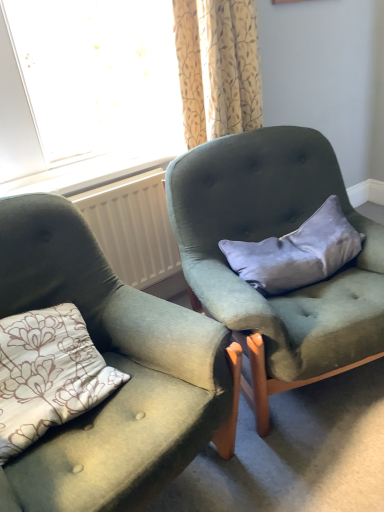
The image size is (384, 512). In order to click on velvet green armchair at center, which is the 2th chair in right-to-left order in this screenshot , I will do `click(110, 365)`.

The height and width of the screenshot is (512, 384). What do you see at coordinates (297, 252) in the screenshot?
I see `velvet gray pillow at center` at bounding box center [297, 252].

Where is `velvet green armchair at center, acting as the 1th chair starting from the left`? The width and height of the screenshot is (384, 512). velvet green armchair at center, acting as the 1th chair starting from the left is located at coordinates (x=110, y=365).

Is velvet green armchair at center, which is the first chair in right-to-left order, positioned with its back to velvet green armchair at center, which is the 2th chair in right-to-left order?

velvet green armchair at center, which is the first chair in right-to-left order, does not have its back to velvet green armchair at center, which is the 2th chair in right-to-left order.

Is velvet green armchair at center, which is the first chair in right-to-left order, not within velvet green armchair at center, acting as the 1th chair starting from the left?

→ Yes, velvet green armchair at center, which is the first chair in right-to-left order, is outside of velvet green armchair at center, acting as the 1th chair starting from the left.

From a real-world perspective, is velvet green armchair at center, which is the first chair in right-to-left order, below velvet green armchair at center, which is the 2th chair in right-to-left order?

Yes, from a real-world perspective, velvet green armchair at center, which is the first chair in right-to-left order, is beneath velvet green armchair at center, which is the 2th chair in right-to-left order.

Considering the positions of points (290, 319) and (223, 399), is point (290, 319) farther from camera compared to point (223, 399)?

Yes, point (290, 319) is behind point (223, 399).

Between white plastic radiator at center and floral fabric curtain at upper center, which one has more height?

floral fabric curtain at upper center is taller.

Considering the points (166, 274) and (212, 42), which point is behind, point (166, 274) or point (212, 42)?

Point (166, 274)

Is white plastic radiator at center placed right next to floral fabric curtain at upper center?

No, white plastic radiator at center is not in contact with floral fabric curtain at upper center.

Would you say floral fabric curtain at upper center is part of white plastic radiator at center's contents?

No.

Is velvet gray pillow at center not near velvet green armchair at center, which is the first chair in right-to-left order?

No, there isn't a large distance between velvet gray pillow at center and velvet green armchair at center, which is the first chair in right-to-left order.

Considering the relative sizes of velvet gray pillow at center and velvet green armchair at center, which is the first chair in right-to-left order, in the image provided, is velvet gray pillow at center thinner than velvet green armchair at center, which is the first chair in right-to-left order,?

Correct, the width of velvet gray pillow at center is less than that of velvet green armchair at center, which is the first chair in right-to-left order.

From the image's perspective, does velvet gray pillow at center appear lower than velvet green armchair at center, which is counted as the second chair, starting from the left?

No, from the image's perspective, velvet gray pillow at center is not below velvet green armchair at center, which is counted as the second chair, starting from the left.

From a real-world perspective, which is physically below, white plastic radiator at center or velvet gray pillow at center?

white plastic radiator at center is physically lower.

From the image's perspective, is white plastic radiator at center below velvet gray pillow at center?

Actually, white plastic radiator at center appears above velvet gray pillow at center in the image.

Is point (151, 174) positioned in front of point (336, 216)?

That is False.

The height and width of the screenshot is (512, 384). Identify the location of the 1st chair in front of the floral fabric curtain at upper center, counting from the anchor's position. (276, 236).

From the picture: Does velvet green armchair at center, which is counted as the second chair, starting from the left, have a greater height compared to floral fabric curtain at upper center?

Yes.

Between point (299, 352) and point (227, 86), which one is positioned behind?

The point (227, 86) is farther from the camera.

Is velvet green armchair at center, which is counted as the second chair, starting from the left, next to floral fabric curtain at upper center and touching it?

No, velvet green armchair at center, which is counted as the second chair, starting from the left, is not with floral fabric curtain at upper center.

Is velvet gray pillow at center facing towards velvet green armchair at center, acting as the 1th chair starting from the left?

No, velvet gray pillow at center does not turn towards velvet green armchair at center, acting as the 1th chair starting from the left.

Considering the relative positions of velvet gray pillow at center and velvet green armchair at center, acting as the 1th chair starting from the left, in the image provided, is velvet gray pillow at center to the right of velvet green armchair at center, acting as the 1th chair starting from the left, from the viewer's perspective?

Yes.

In terms of width, does velvet gray pillow at center look wider or thinner when compared to velvet green armchair at center, acting as the 1th chair starting from the left?

Clearly, velvet gray pillow at center has less width compared to velvet green armchair at center, acting as the 1th chair starting from the left.

Between velvet gray pillow at center and velvet green armchair at center, acting as the 1th chair starting from the left, which one has smaller size?

velvet gray pillow at center.

What's the angular difference between velvet gray pillow at center and floral fabric curtain at upper center's facing directions?

16 degrees.

Is velvet gray pillow at center to the right of floral fabric curtain at upper center from the viewer's perspective?

Yes, velvet gray pillow at center is to the right of floral fabric curtain at upper center.

Can you confirm if velvet gray pillow at center is taller than floral fabric curtain at upper center?

Incorrect, the height of velvet gray pillow at center is not larger of that of floral fabric curtain at upper center.

Considering the sizes of objects velvet gray pillow at center and floral fabric curtain at upper center in the image provided, who is bigger, velvet gray pillow at center or floral fabric curtain at upper center?

With larger size is floral fabric curtain at upper center.

There is a velvet green armchair at center, which is counted as the second chair, starting from the left. At what (x,y) coordinates should I click in order to perform the action: click on chair above it (from a real-world perspective). Please return your answer as a coordinate pair (x, y). This screenshot has height=512, width=384. Looking at the image, I should click on (110, 365).

I want to click on radiator that appears behind the floral fabric curtain at upper center, so click(133, 227).

Based on the photo, from the image, which object appears to be farther from velvet gray pillow at center, white plastic radiator at center or floral fabric curtain at upper center?

Based on the image, floral fabric curtain at upper center appears to be further to velvet gray pillow at center.

When comparing their distances from white plastic radiator at center, does velvet green armchair at center, acting as the 1th chair starting from the left, or velvet gray pillow at center seem further?

The object further to white plastic radiator at center is velvet gray pillow at center.

Based on their spatial positions, is white plastic radiator at center or velvet gray pillow at center closer to velvet green armchair at center, which is the 2th chair in right-to-left order?

Among the two, velvet gray pillow at center is located nearer to velvet green armchair at center, which is the 2th chair in right-to-left order.

Looking at the image, which one is located further to velvet gray pillow at center, floral fabric curtain at upper center or white plastic radiator at center?

Among the two, floral fabric curtain at upper center is located further to velvet gray pillow at center.

Considering their positions, is velvet gray pillow at center positioned closer to velvet green armchair at center, which is counted as the second chair, starting from the left, than velvet green armchair at center, acting as the 1th chair starting from the left?

velvet gray pillow at center is closer to velvet green armchair at center, which is counted as the second chair, starting from the left.

Estimate the real-world distances between objects in this image. Which object is closer to floral fabric curtain at upper center, velvet green armchair at center, which is the 2th chair in right-to-left order, or velvet green armchair at center, which is counted as the second chair, starting from the left?

Among the two, velvet green armchair at center, which is counted as the second chair, starting from the left, is located nearer to floral fabric curtain at upper center.

Considering their positions, is velvet green armchair at center, acting as the 1th chair starting from the left, positioned closer to velvet green armchair at center, which is counted as the second chair, starting from the left, than floral fabric curtain at upper center?

Based on the image, velvet green armchair at center, acting as the 1th chair starting from the left, appears to be nearer to velvet green armchair at center, which is counted as the second chair, starting from the left.

When comparing their distances from floral fabric curtain at upper center, does velvet green armchair at center, which is counted as the second chair, starting from the left, or white plastic radiator at center seem further?

white plastic radiator at center.

This screenshot has width=384, height=512. Find the location of `pillow between floral fabric curtain at upper center and velvet green armchair at center, acting as the 1th chair starting from the left, in the vertical direction`. pillow between floral fabric curtain at upper center and velvet green armchair at center, acting as the 1th chair starting from the left, in the vertical direction is located at coordinates (297, 252).

This screenshot has width=384, height=512. Identify the location of curtain located between velvet green armchair at center, acting as the 1th chair starting from the left, and white plastic radiator at center in the depth direction. (217, 67).

Where is `radiator between floral fabric curtain at upper center and velvet gray pillow at center in the up-down direction`? This screenshot has height=512, width=384. radiator between floral fabric curtain at upper center and velvet gray pillow at center in the up-down direction is located at coordinates (133, 227).

At what (x,y) coordinates should I click in order to perform the action: click on chair between floral fabric curtain at upper center and velvet green armchair at center, which is the 2th chair in right-to-left order, vertically. Please return your answer as a coordinate pair (x, y). This screenshot has height=512, width=384. Looking at the image, I should click on (276, 236).